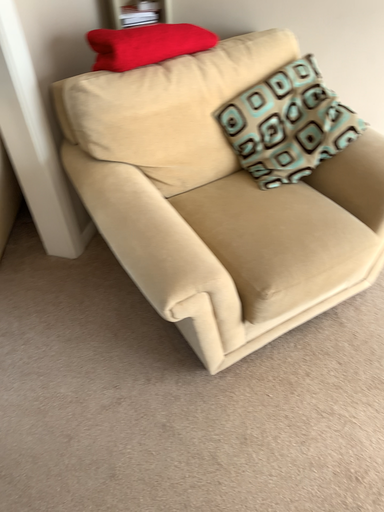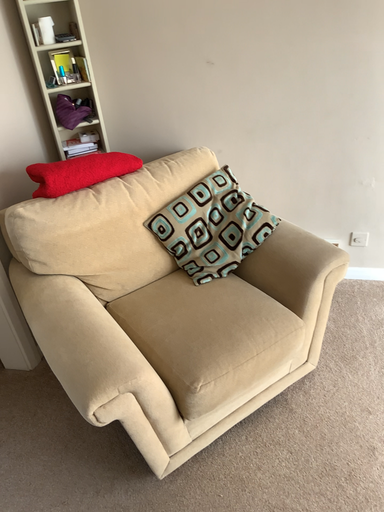
Question: Which way did the camera rotate in the video?

Choices:
 (A) rotated upward
 (B) rotated downward

Answer: (A)